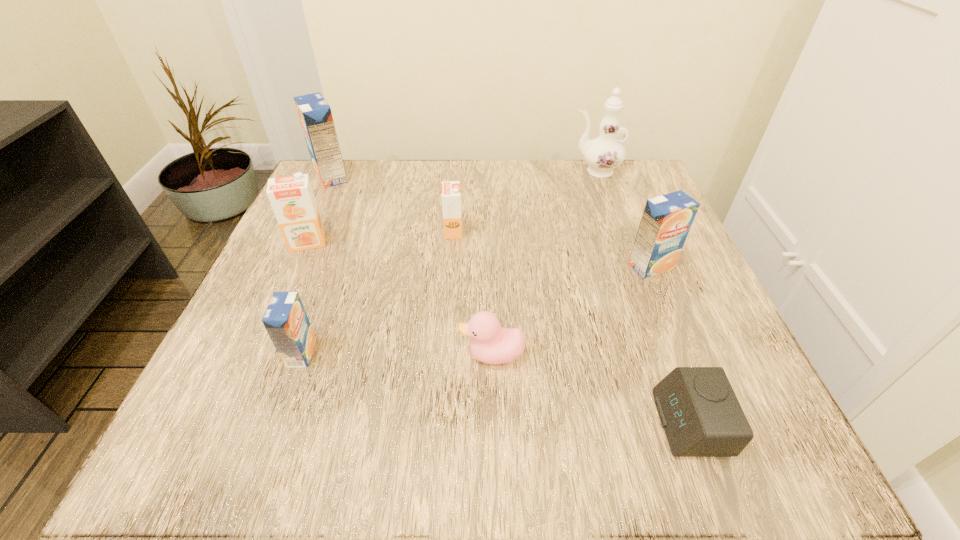
Where is `object at the near edge`? The image size is (960, 540). object at the near edge is located at coordinates (701, 416).

This screenshot has height=540, width=960. Find the location of `chinaware situated at the right edge`. chinaware situated at the right edge is located at coordinates (604, 153).

The height and width of the screenshot is (540, 960). I want to click on orange_juice situated at the right edge, so click(666, 220).

Where is `alarm clock that is at the right edge`? alarm clock that is at the right edge is located at coordinates (701, 416).

Where is `object at the far left corner`? Image resolution: width=960 pixels, height=540 pixels. object at the far left corner is located at coordinates tap(315, 115).

Image resolution: width=960 pixels, height=540 pixels. What are the coordinates of `object that is at the far right corner` in the screenshot? It's located at (604, 153).

Identify the location of object located in the near right corner section of the desktop. (701, 416).

This screenshot has height=540, width=960. Identify the location of vacant space at the far edge of the desktop. (581, 198).

You are a GUI agent. You are given a task and a screenshot of the screen. Output one action in this format:
    pyautogui.click(x=<x>, y=<y>)
    Task: Click on the free space at the near edge of the desktop
    Image resolution: width=960 pixels, height=540 pixels.
    Given the screenshot: What is the action you would take?
    pyautogui.click(x=364, y=415)

At what (x,y) coordinates should I click in order to perform the action: click on vacant space at the left edge of the desktop. Please return your answer as a coordinate pair (x, y). Looking at the image, I should click on (349, 226).